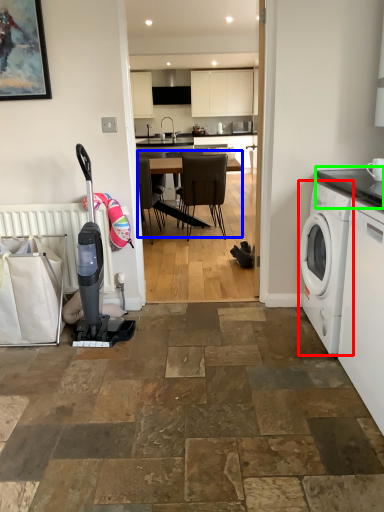
Question: Considering the real-world distances, which object is farthest from washing machine (highlighted by a red box)? kitchen & dining room table (highlighted by a blue box) or countertop (highlighted by a green box)?

Choices:
 (A) kitchen & dining room table
 (B) countertop

Answer: (A)